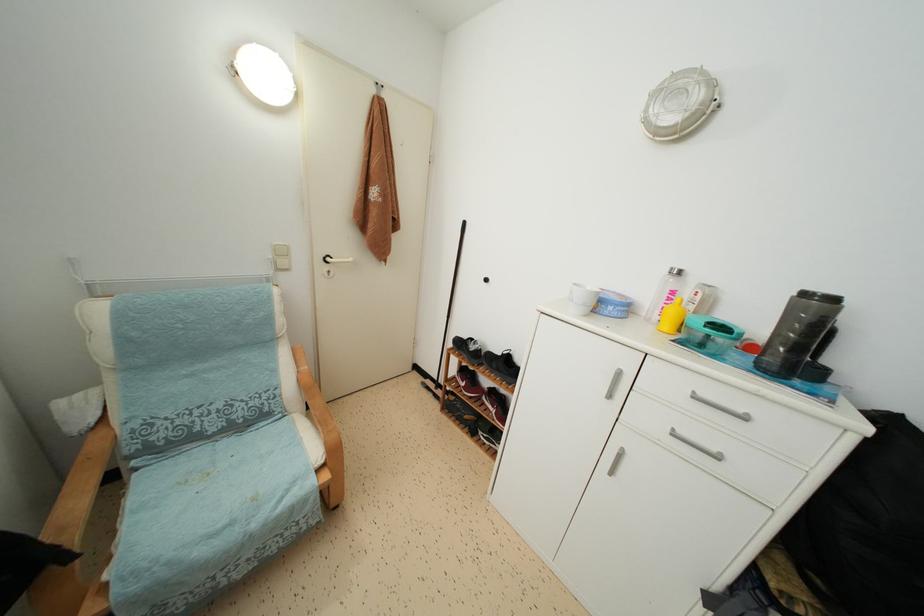
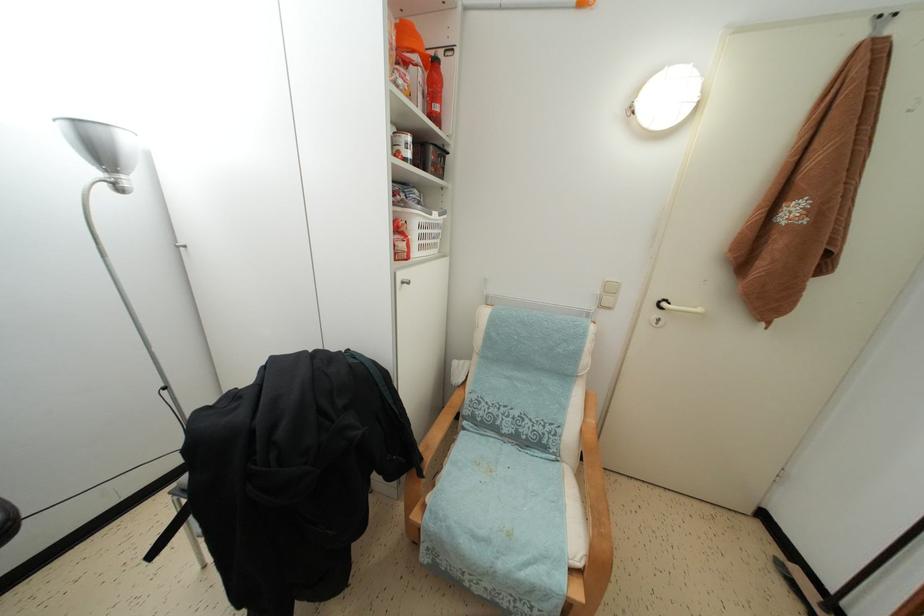
Question: Based on the continuous images, in which direction is the camera rotating? Reply with the corresponding letter.

Choices:
 (A) Left
 (B) Right
 (C) Up
 (D) Down

Answer: (A)